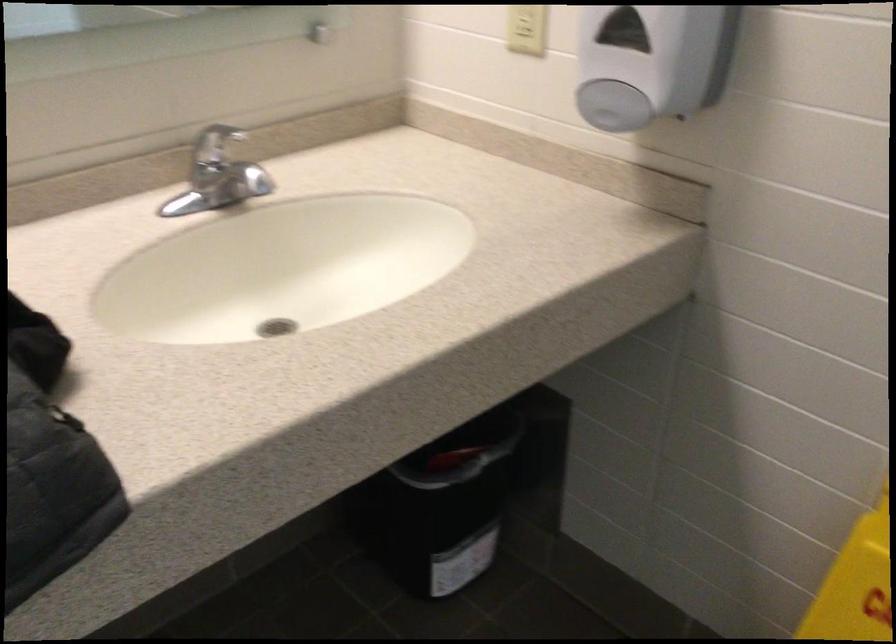
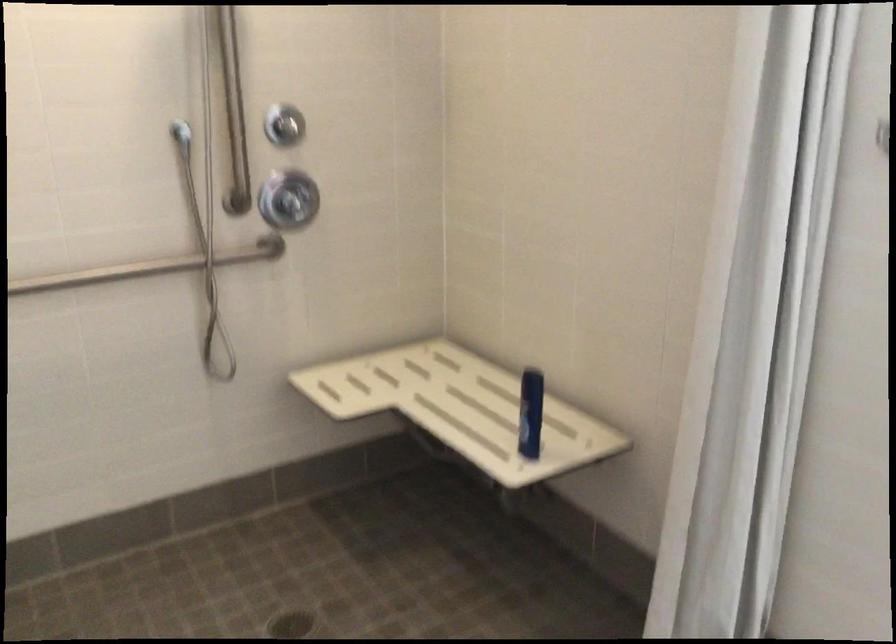
Question: The images are taken continuously from a first-person perspective. In which direction are you moving?

Choices:
 (A) Left
 (B) Right
 (C) Forward
 (D) Backward

Answer: (B)